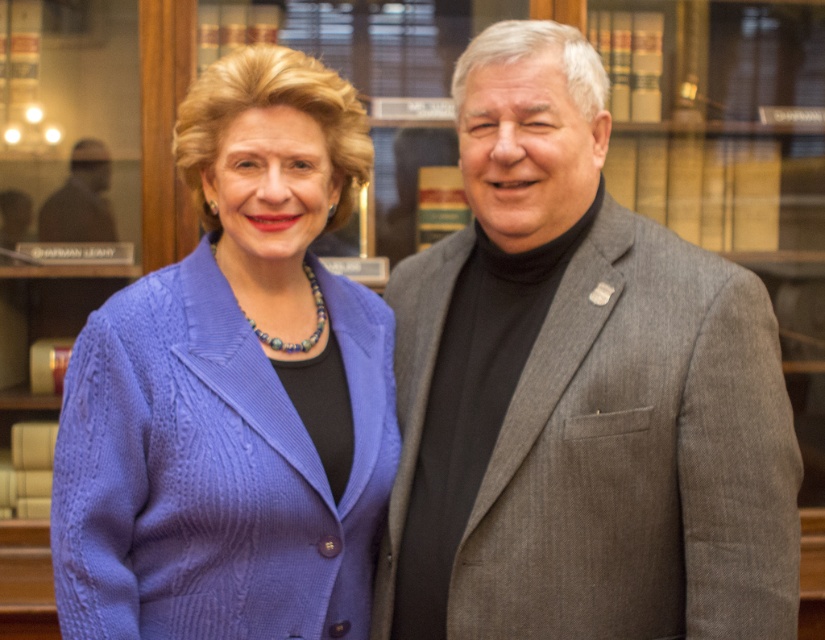
This screenshot has height=640, width=825. What do you see at coordinates (578, 394) in the screenshot? I see `gray wool suit at center` at bounding box center [578, 394].

Does gray wool suit at center have a smaller size compared to cable-knit sweater at left?

Incorrect, gray wool suit at center is not smaller in size than cable-knit sweater at left.

Is point (786, 534) more distant than point (88, 420)?

No, it is in front of (88, 420).

The image size is (825, 640). What are the coordinates of `gray wool suit at center` in the screenshot? It's located at (578, 394).